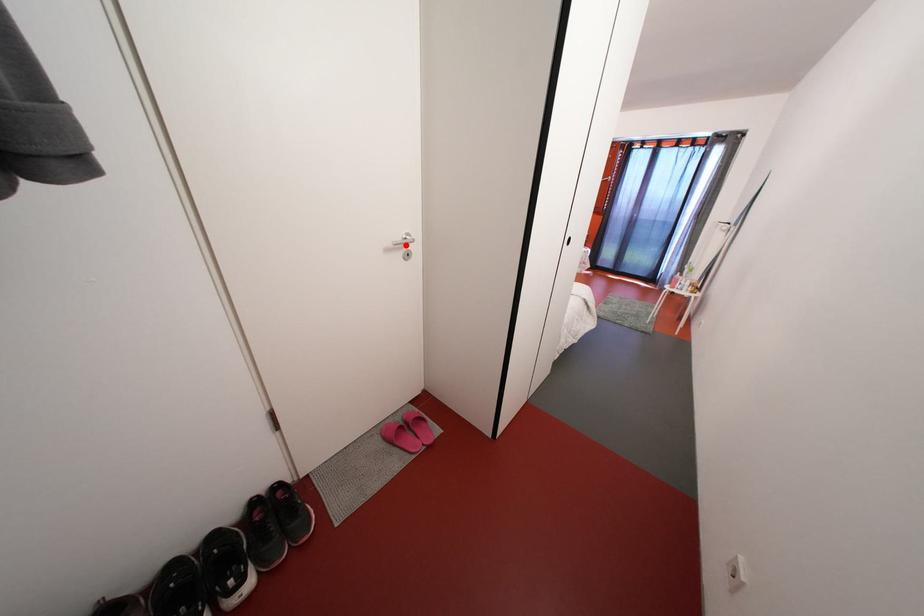
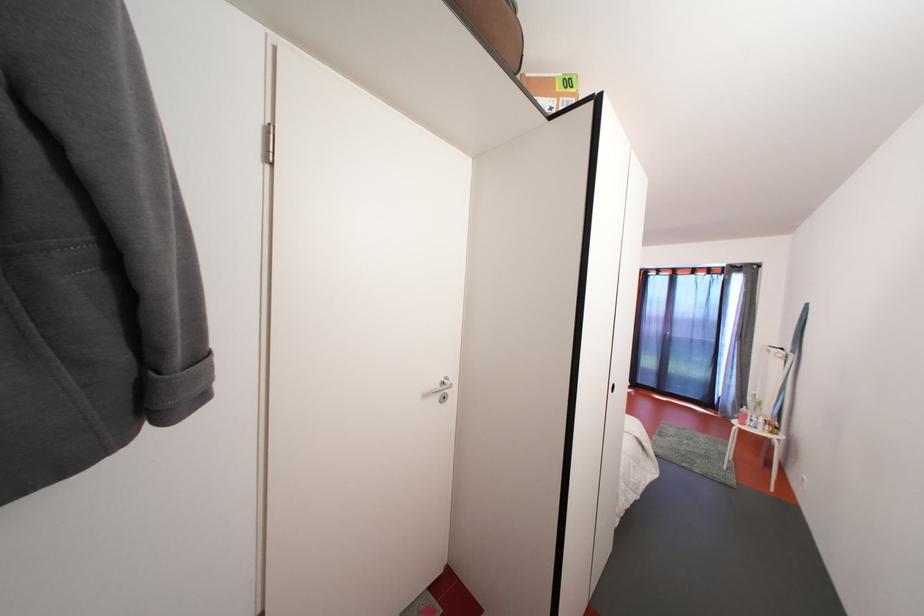
Question: I am providing you with two images of the same scene from different viewpoints. Image1 has a red point marked. In image2, the corresponding 3D location appears at what relative position? Reply with the corresponding letter.

Choices:
 (A) Closer
 (B) Farther

Answer: (B)